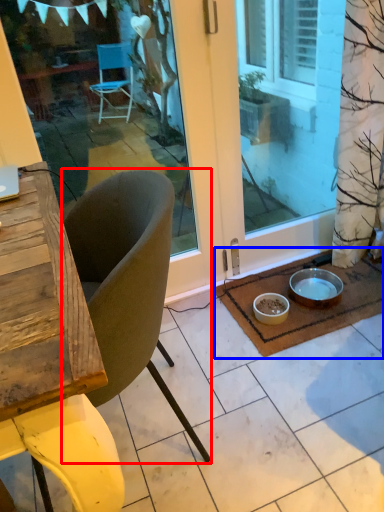
Question: Among these objects, which one is farthest to the camera, chair (highlighted by a red box) or doormat (highlighted by a blue box)?

Choices:
 (A) chair
 (B) doormat

Answer: (B)